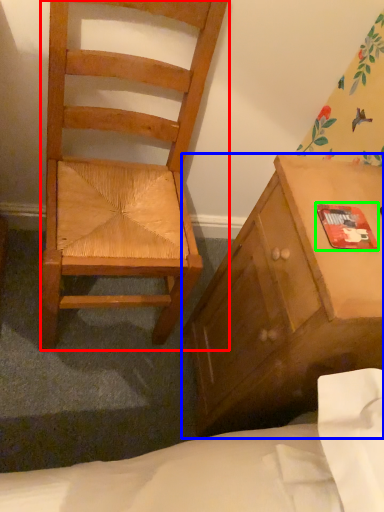
Question: Which object is positioned closest to chair (highlighted by a red box)? Select from cabinetry (highlighted by a blue box) and paperback book (highlighted by a green box).

Choices:
 (A) cabinetry
 (B) paperback book

Answer: (A)